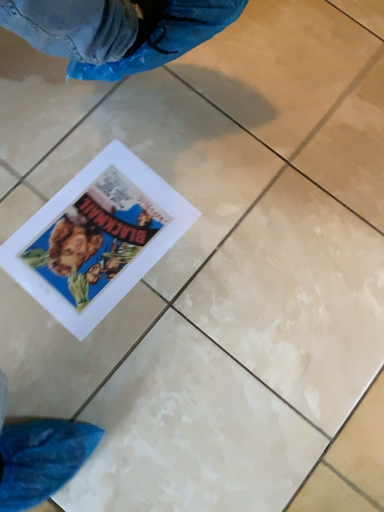
This screenshot has height=512, width=384. I want to click on free space underneath blue matte poster at center (from a real-world perspective), so click(x=104, y=227).